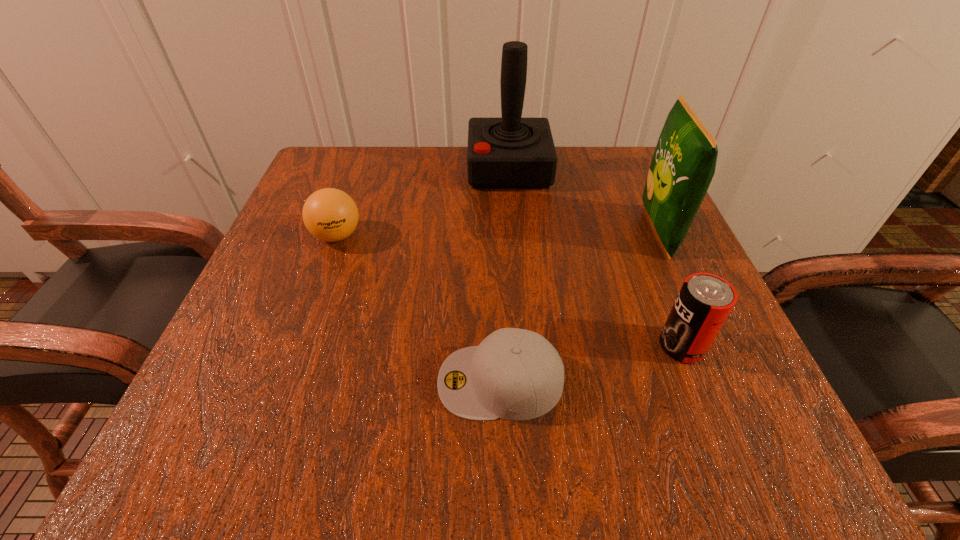
Find the location of a particular element. The image size is (960, 540). vacant space located on the front-facing side of the crisp (potato chip) is located at coordinates (542, 232).

Locate an element on the screen. The width and height of the screenshot is (960, 540). free space located on the front-facing side of the crisp (potato chip) is located at coordinates tap(589, 232).

This screenshot has height=540, width=960. Identify the location of vacant space located 0.300m on the left of the third shortest object. (458, 346).

Image resolution: width=960 pixels, height=540 pixels. What are the coordinates of `vacant area situated 0.220m on the side with brand of the leftmost object` in the screenshot? It's located at (295, 353).

Locate an element on the screen. This screenshot has height=540, width=960. free location located on the front-facing side of the shortest object is located at coordinates (345, 381).

Locate an element on the screen. free space located 0.280m on the front-facing side of the shortest object is located at coordinates (236, 381).

Locate an element on the screen. free space located 0.100m on the front-facing side of the shortest object is located at coordinates click(x=366, y=381).

Find the location of a particular element. joystick present at the far edge is located at coordinates (511, 152).

Where is `crisp (potato chip) at the far edge`? This screenshot has height=540, width=960. crisp (potato chip) at the far edge is located at coordinates (683, 165).

Where is `object that is at the near edge`? object that is at the near edge is located at coordinates click(x=514, y=374).